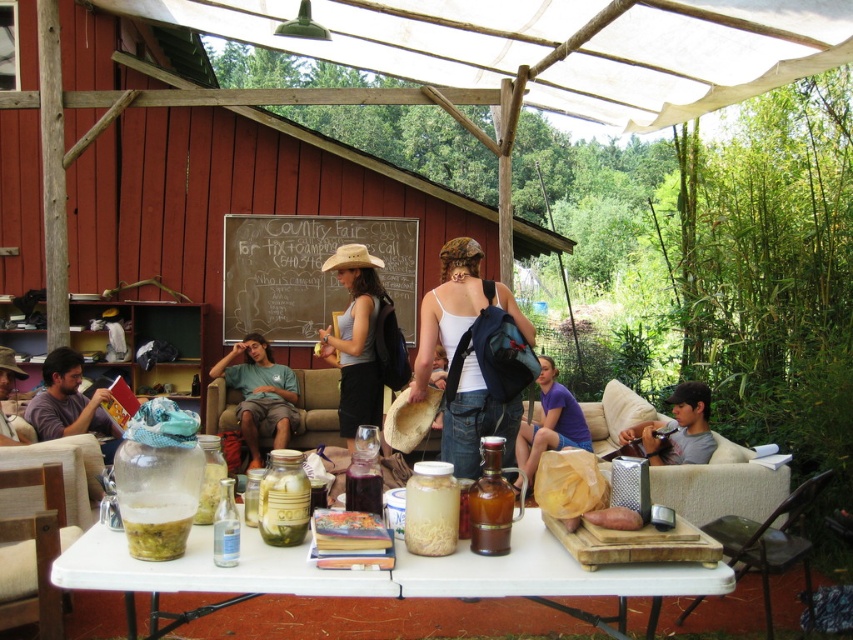
From the picture: You are organizing a picnic and have a small backpack. You need to decide which item to bring first between the translucent plastic table at center and the chalkboard at center. Based on their sizes, which one should you choose?

The translucent plastic table at center is smaller than the chalkboard at center, so you should bring the translucent plastic table at center first since it takes up less space in your backpack.

You are setting up a small stand at the event and need to place a sign on the taller object between the translucent plastic table at center and the chalkboard at center. Which object should you choose?

The chalkboard at center is taller than the translucent plastic table at center, so you should place the sign on the chalkboard at center.